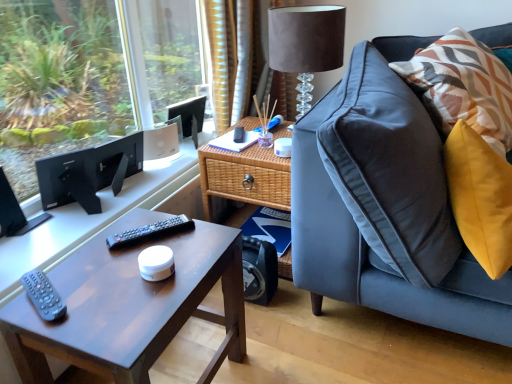
Where is `vacant area located to the right-hand side of black plastic remote at lower left, the 1th remote in the bottom-to-top sequence`? This screenshot has height=384, width=512. vacant area located to the right-hand side of black plastic remote at lower left, the 1th remote in the bottom-to-top sequence is located at coordinates (111, 302).